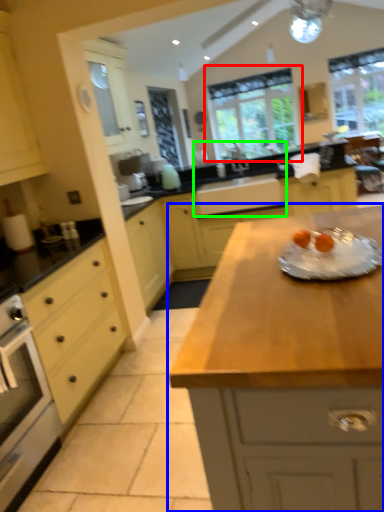
Question: Which object is the closest to the window (highlighted by a red box)? Choose among these: countertop (highlighted by a blue box) or sink (highlighted by a green box).

Choices:
 (A) countertop
 (B) sink

Answer: (B)